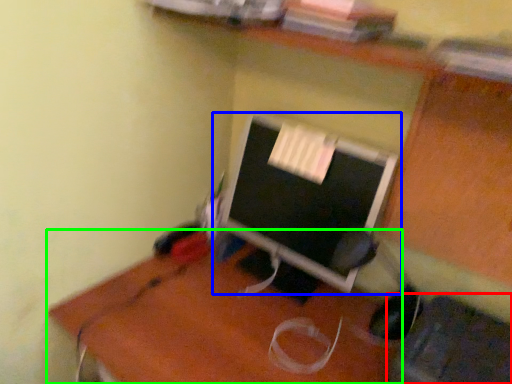
Question: Which object is the closest to the computer chair (highlighted by a red box)? Choose among these: computer monitor (highlighted by a blue box) or desk (highlighted by a green box).

Choices:
 (A) computer monitor
 (B) desk

Answer: (B)